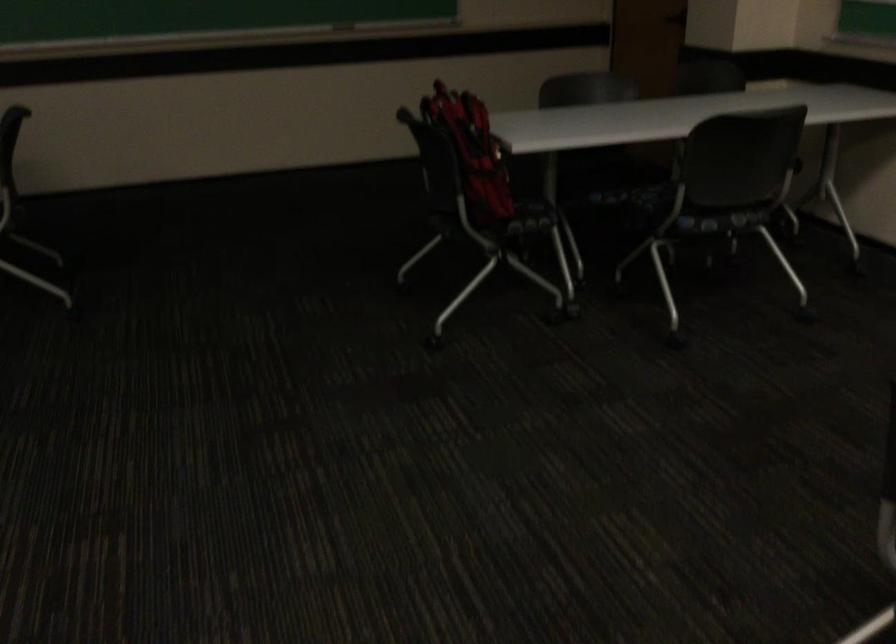
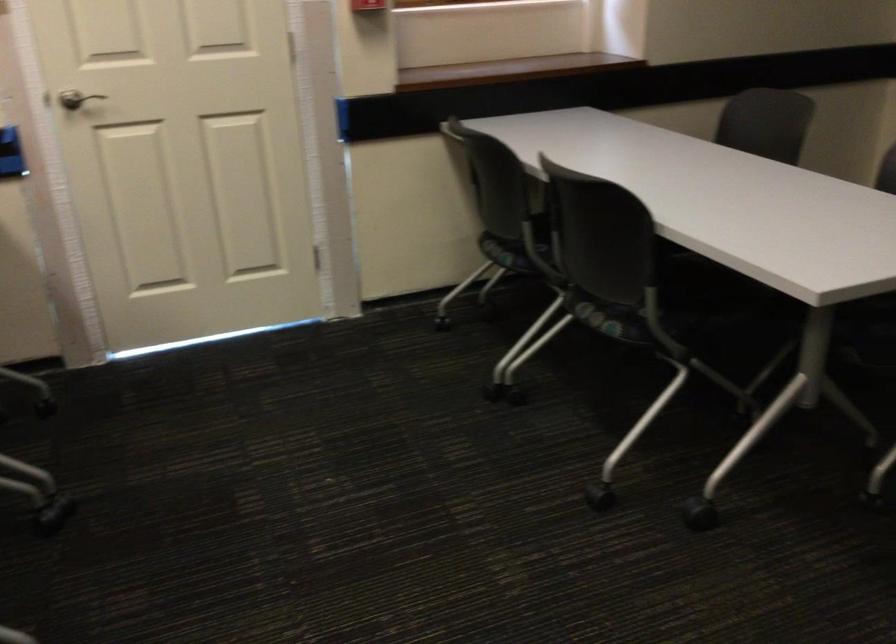
Based on the continuous images, in which direction is the camera rotating?

The camera's rotation is toward left-down.